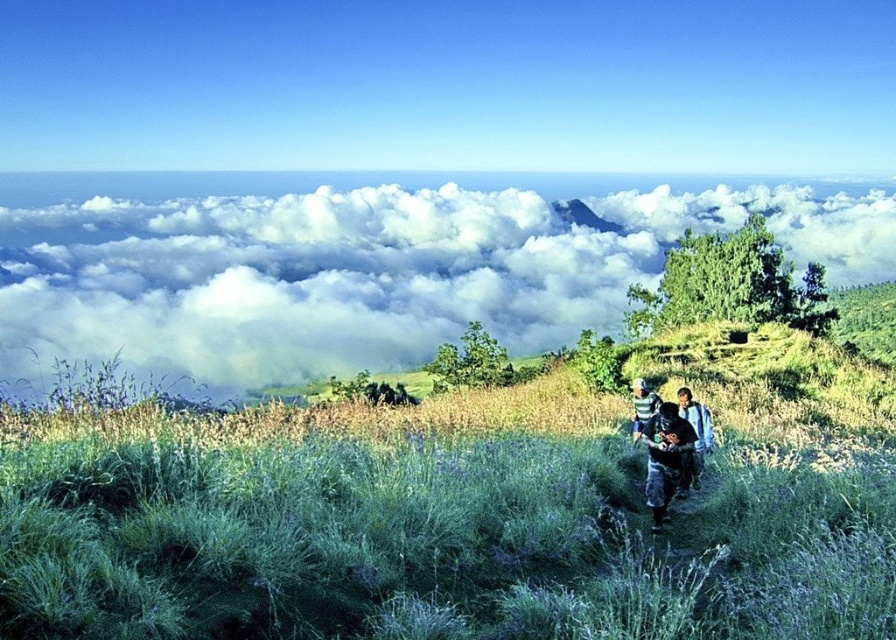
You are standing at the center of the image and want to take a photo of the green grassy area. According to the coordinates provided, in which direction should you move to get closer to the green grassy at center?

The green grassy at center is located at point 0.847 on the x and 0.490 on the y. Since you are at the center, which is typically at coordinates 0.5, you should move to the right and slightly forward to reach it.

You are standing on the hillside and want to take a photo of the white fluffy cloud at upper center. If your camera has a maximum focus range of 10 meters, will you be able to capture it clearly?

The white fluffy cloud at upper center is 9.01 meters away from the viewer. Since the camera can focus up to 10 meters, you can capture it clearly within the range.

You are planning to take a photo of the striped fabric shirt at center against the white fluffy cloud at upper center as the background. Considering their sizes, will the shirt appear smaller or larger in the photo compared to the cloud?

The white fluffy cloud at upper center has a larger size compared to striped fabric shirt at center, so the striped fabric shirt at center will appear smaller in the photo compared to the cloud.